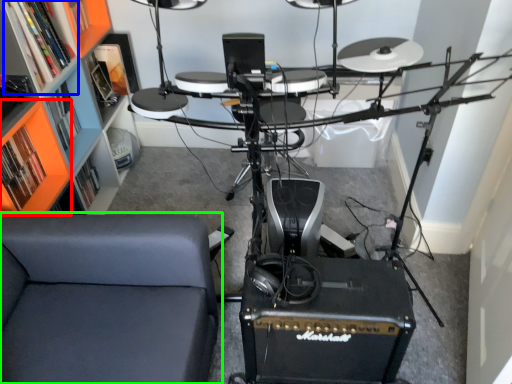
Question: Which object is the closest to the shelf (highlighted by a red box)? Choose among these: shelf (highlighted by a blue box) or furniture (highlighted by a green box).

Choices:
 (A) shelf
 (B) furniture

Answer: (A)